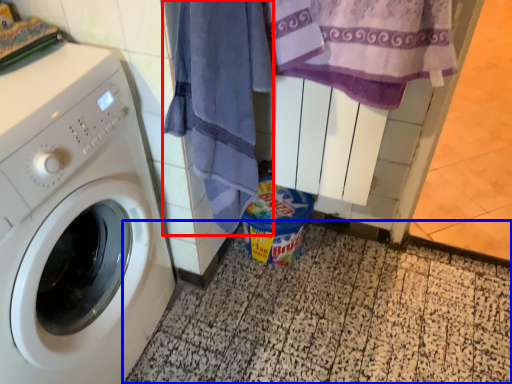
Question: Which point is further to the camera, beach towel (highlighted by a red box) or tile (highlighted by a blue box)?

Choices:
 (A) beach towel
 (B) tile

Answer: (B)